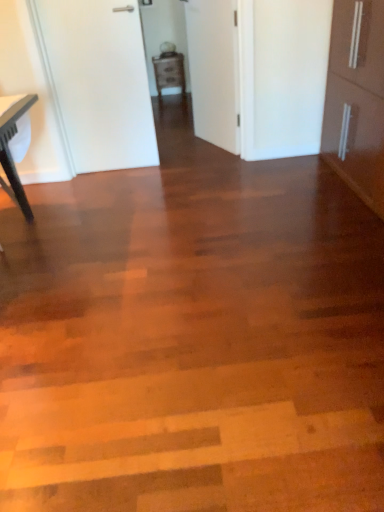
Describe the element at coordinates (11, 154) in the screenshot. I see `matte black table at left` at that location.

Describe the element at coordinates (169, 72) in the screenshot. The height and width of the screenshot is (512, 384). I see `matte brown cabinet at center` at that location.

This screenshot has height=512, width=384. What are the coordinates of `white matte door at upper left, marked as the second door in a right-to-left arrangement` in the screenshot? It's located at (98, 82).

I want to click on matte black table at left, so click(11, 154).

Is white matte door at upper left, marked as the second door in a right-to-left arrangement, aimed at matte black table at left?

No, white matte door at upper left, marked as the second door in a right-to-left arrangement, is not turned towards matte black table at left.

Is white matte door at upper left, the 1th door from the left, not inside matte black table at left?

white matte door at upper left, the 1th door from the left, is positioned outside matte black table at left.

Where is `table in front of the white matte door at upper left, the 1th door from the left`? table in front of the white matte door at upper left, the 1th door from the left is located at coordinates (11, 154).

In the image, there is a matte black table at left. Find the location of `cabinetry above it (from the image's perspective)`. cabinetry above it (from the image's perspective) is located at coordinates (169, 72).

Is matte brown cabinet at center inside the boundaries of matte black table at left, or outside?

matte brown cabinet at center is not enclosed by matte black table at left.

Could you tell me if matte brown cabinet at center is facing matte black table at left?

No.

Is matte brown cabinet at center positioned far away from matte black table at left?

Yes, matte brown cabinet at center and matte black table at left are quite far apart.

Is white matte door at center, which ranks as the 2th door in left-to-right order, next to matte brown cabinet at center?

No, white matte door at center, which ranks as the 2th door in left-to-right order, is not making contact with matte brown cabinet at center.

Is matte brown cabinet at center completely or partially inside white matte door at center, which ranks as the 2th door in left-to-right order?

No, matte brown cabinet at center is not surrounded by white matte door at center, which ranks as the 2th door in left-to-right order.

Can you tell me how much white matte door at center, which ranks as the 2th door in left-to-right order, and matte brown cabinet at center differ in facing direction?

The facing directions of white matte door at center, which ranks as the 2th door in left-to-right order, and matte brown cabinet at center are 67.3 degrees apart.

Is white matte door at center, which ranks as the 2th door in left-to-right order, taller than matte brown cabinet at center?

Correct, white matte door at center, which ranks as the 2th door in left-to-right order, is much taller as matte brown cabinet at center.

Which is closer to the camera, (117, 71) or (212, 101)?

Point (117, 71) is closer to the camera than point (212, 101).

From the image's perspective, who appears lower, white matte door at upper left, the 1th door from the left, or white matte door at center, which ranks as the 2th door in left-to-right order?

white matte door at upper left, the 1th door from the left.

In the scene shown: Does white matte door at upper left, the 1th door from the left, turn towards white matte door at center, which ranks as the 2th door in left-to-right order?

No, white matte door at upper left, the 1th door from the left, is not oriented towards white matte door at center, which ranks as the 2th door in left-to-right order.

Which object is positioned more to the left, white matte door at upper left, marked as the second door in a right-to-left arrangement, or white matte door at center, which is the first door from right to left?

Positioned to the left is white matte door at upper left, marked as the second door in a right-to-left arrangement.

Considering the sizes of objects white matte door at center, which ranks as the 2th door in left-to-right order, and matte black table at left in the image provided, who is bigger, white matte door at center, which ranks as the 2th door in left-to-right order, or matte black table at left?

matte black table at left.

Which object is further away from the camera taking this photo, white matte door at center, which is the first door from right to left, or matte black table at left?

Positioned behind is white matte door at center, which is the first door from right to left.

From the image's perspective, which is below, white matte door at center, which is the first door from right to left, or matte black table at left?

matte black table at left appears lower in the image.

Is matte black table at left outside of white matte door at center, which ranks as the 2th door in left-to-right order?

Yes, matte black table at left is located beyond the bounds of white matte door at center, which ranks as the 2th door in left-to-right order.

Relative to white matte door at center, which is the first door from right to left, is matte black table at left in front or behind?

matte black table at left is positioned closer to the viewer than white matte door at center, which is the first door from right to left.

How far apart are matte black table at left and white matte door at center, which ranks as the 2th door in left-to-right order?

The distance of matte black table at left from white matte door at center, which ranks as the 2th door in left-to-right order, is 1.65 meters.

Looking at the image, does matte black table at left seem bigger or smaller compared to white matte door at center, which is the first door from right to left?

In the image, matte black table at left appears to be larger than white matte door at center, which is the first door from right to left.

From the image's perspective, who appears lower, matte brown cabinet at center or white matte door at center, which ranks as the 2th door in left-to-right order?

white matte door at center, which ranks as the 2th door in left-to-right order, is shown below in the image.

Does matte brown cabinet at center turn towards white matte door at center, which ranks as the 2th door in left-to-right order?

Yes, matte brown cabinet at center is aimed at white matte door at center, which ranks as the 2th door in left-to-right order.

Considering the sizes of objects matte brown cabinet at center and white matte door at center, which is the first door from right to left, in the image provided, who is taller, matte brown cabinet at center or white matte door at center, which is the first door from right to left,?

Standing taller between the two is white matte door at center, which is the first door from right to left.

Is point (184, 75) positioned in front of point (209, 102)?

No, it is not.

Identify the location of table in front of the white matte door at upper left, the 1th door from the left. This screenshot has height=512, width=384. click(11, 154).

Identify the location of cabinetry above the matte black table at left (from the image's perspective). (169, 72).

Estimate the real-world distances between objects in this image. Which object is closer to white matte door at upper left, the 1th door from the left, matte brown cabinet at center or matte black table at left?

matte black table at left is positioned closer to the anchor white matte door at upper left, the 1th door from the left.

Considering their positions, is white matte door at center, which ranks as the 2th door in left-to-right order, positioned further to white matte door at upper left, the 1th door from the left, than matte black table at left?

The object further to white matte door at upper left, the 1th door from the left, is matte black table at left.

Considering their positions, is white matte door at upper left, marked as the second door in a right-to-left arrangement, positioned further to white matte door at center, which is the first door from right to left, than matte black table at left?

Among the two, matte black table at left is located further to white matte door at center, which is the first door from right to left.

Which object lies nearer to the anchor point white matte door at center, which is the first door from right to left, matte black table at left or matte brown cabinet at center?

Based on the image, matte black table at left appears to be nearer to white matte door at center, which is the first door from right to left.

From the image, which object appears to be nearer to white matte door at center, which ranks as the 2th door in left-to-right order, matte black table at left or white matte door at upper left, the 1th door from the left?

white matte door at upper left, the 1th door from the left.

From the image, which object appears to be nearer to matte brown cabinet at center, white matte door at center, which ranks as the 2th door in left-to-right order, or matte black table at left?

white matte door at center, which ranks as the 2th door in left-to-right order.

Looking at the image, which one is located closer to white matte door at upper left, the 1th door from the left, white matte door at center, which ranks as the 2th door in left-to-right order, or matte brown cabinet at center?

Among the two, white matte door at center, which ranks as the 2th door in left-to-right order, is located nearer to white matte door at upper left, the 1th door from the left.

Based on their spatial positions, is white matte door at upper left, the 1th door from the left, or matte black table at left closer to matte brown cabinet at center?

white matte door at upper left, the 1th door from the left.

Identify the location of door between matte black table at left and white matte door at center, which ranks as the 2th door in left-to-right order, from left to right. Image resolution: width=384 pixels, height=512 pixels. (98, 82).

Identify the location of door between white matte door at upper left, marked as the second door in a right-to-left arrangement, and matte brown cabinet at center, along the z-axis. (214, 71).